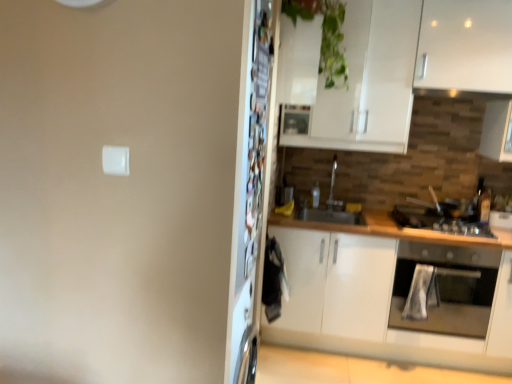
Question: Looking at their shapes, would you say black matte gas stove at right is wider or thinner than stainless steel oven at right?

Choices:
 (A) thin
 (B) wide

Answer: (A)

Question: Choose the correct answer: Is black matte gas stove at right inside stainless steel oven at right or outside it?

Choices:
 (A) inside
 (B) outside

Answer: (B)

Question: Considering the real-world distances, which object is farthest from the white matte cabinet at right?

Choices:
 (A) black matte gas stove at right
 (B) metallic refrigerator at center
 (C) green glossy plant at upper center
 (D) stainless steel oven at right
 (E) metallic silver exhaust hood at upper right

Answer: (C)

Question: Which object is positioned closest to the metallic refrigerator at center?

Choices:
 (A) metallic silver exhaust hood at upper right
 (B) black matte gas stove at right
 (C) white matte cabinet at right
 (D) green glossy plant at upper center
 (E) stainless steel oven at right

Answer: (D)